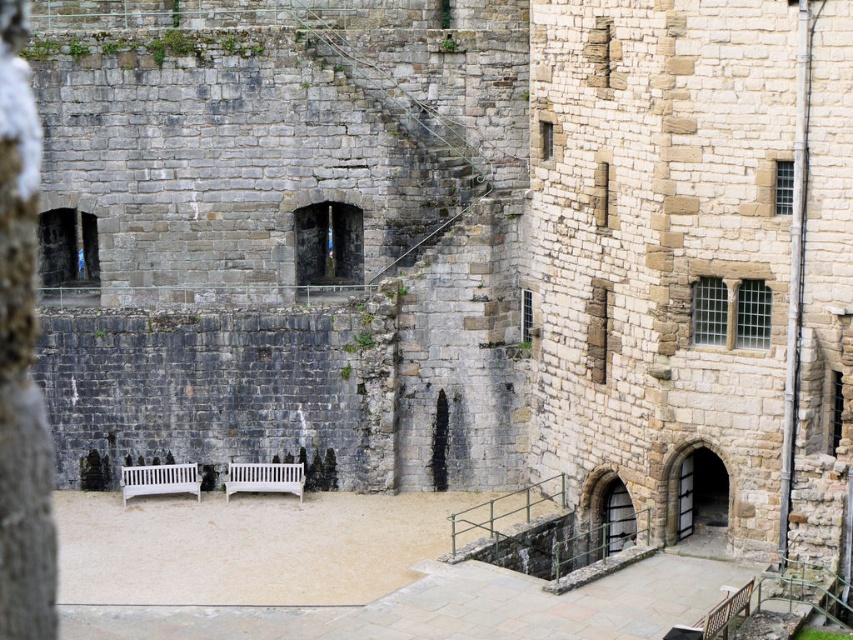
Question: Which point appears closest to the camera in this image?

Choices:
 (A) (135, 472)
 (B) (271, 484)

Answer: (B)

Question: Does white wooden bench at lower left appear on the left side of white wooden bench at center?

Choices:
 (A) yes
 (B) no

Answer: (A)

Question: Can you confirm if white wooden bench at lower left is positioned to the left of white wooden bench at center?

Choices:
 (A) no
 (B) yes

Answer: (B)

Question: Which point appears farthest from the camera in this image?

Choices:
 (A) (277, 484)
 (B) (134, 474)

Answer: (B)

Question: Considering the relative positions of white wooden bench at lower left and white wooden bench at center in the image provided, where is white wooden bench at lower left located with respect to white wooden bench at center?

Choices:
 (A) left
 (B) right

Answer: (A)